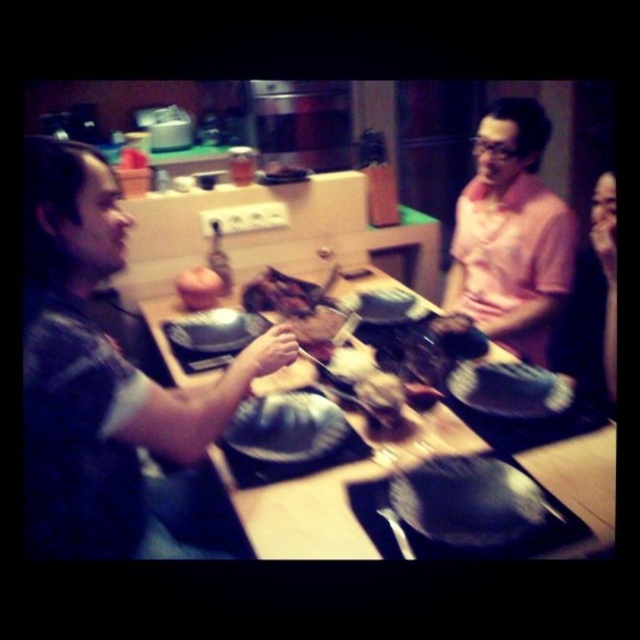
Question: Which point is closer to the camera taking this photo?

Choices:
 (A) (177, 275)
 (B) (388, 307)

Answer: (B)

Question: Does shiny black pan at center come in front of matte black platter at center?

Choices:
 (A) no
 (B) yes

Answer: (B)

Question: Can you confirm if matte black platter at center is positioned to the left of smooth brown rice at center?

Choices:
 (A) yes
 (B) no

Answer: (A)

Question: Is smooth brown rice at center to the right of slightly browned meat at center from the viewer's perspective?

Choices:
 (A) no
 (B) yes

Answer: (A)

Question: Which of the following is the closest to the observer?

Choices:
 (A) (202, 310)
 (B) (477, 332)

Answer: (B)

Question: Based on their relative distances, which object is nearer to the matte black platter at center?

Choices:
 (A) slightly browned meat at center
 (B) white matte plate at center

Answer: (B)